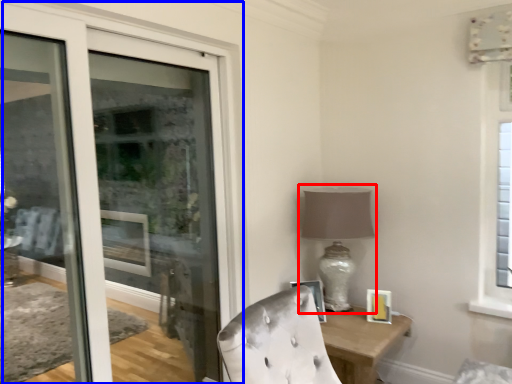
Question: Which object appears farthest to the camera in this image, table lamp (highlighted by a red box) or door (highlighted by a blue box)?

Choices:
 (A) table lamp
 (B) door

Answer: (A)